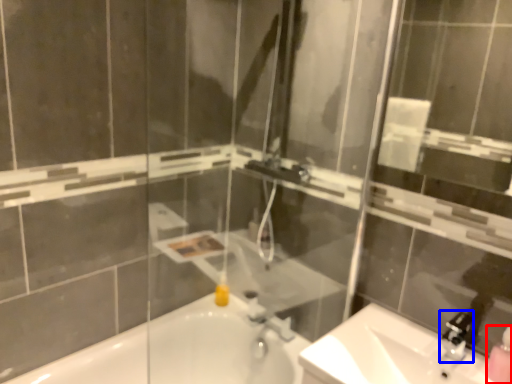
Question: Among these objects, which one is farthest to the camera, soap dispenser (highlighted by a red box) or faucet (highlighted by a blue box)?

Choices:
 (A) soap dispenser
 (B) faucet

Answer: (B)